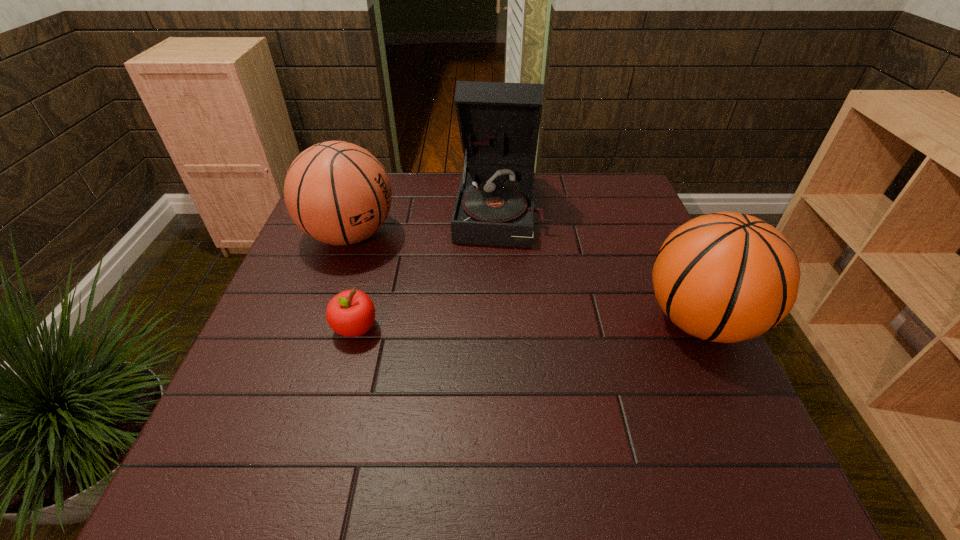
Find the location of a particular element. the shortest object is located at coordinates (351, 313).

Find the location of `the right basketball`. the right basketball is located at coordinates (727, 277).

Locate an element on the screen. the rightmost object is located at coordinates (727, 277).

I want to click on the second object from right to left, so click(499, 123).

Where is `phonograph_record`? The height and width of the screenshot is (540, 960). phonograph_record is located at coordinates (499, 123).

What are the coordinates of `the left basketball` in the screenshot? It's located at (338, 193).

Find the location of a particular element. Image resolution: width=960 pixels, height=540 pixels. vacant region located on the right of the apple is located at coordinates (410, 328).

I want to click on vacant position located on the left of the right basketball, so click(x=498, y=320).

The image size is (960, 540). In order to click on vacant region located 0.150m on the front-facing side of the phonograph_record in this screenshot , I will do `click(494, 287)`.

Image resolution: width=960 pixels, height=540 pixels. I want to click on free spot located 0.360m on the front-facing side of the phonograph_record, so [488, 357].